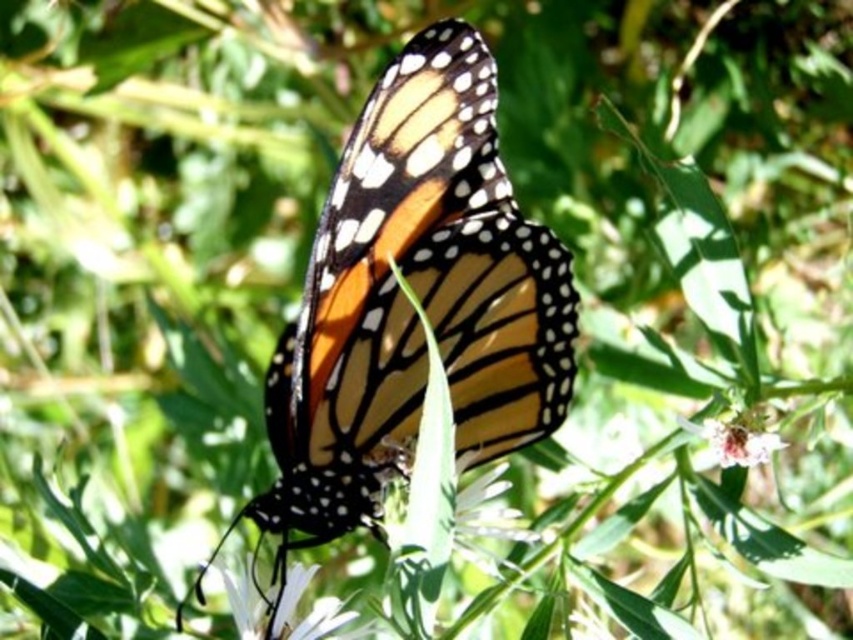
Does orange and black spotted butterfly at center come in front of white textured flower at center?

No, orange and black spotted butterfly at center is behind white textured flower at center.

Who is more forward, (379, 324) or (386, 541)?

Point (386, 541) is in front.

Measure the distance between orange and black spotted butterfly at center and camera.

orange and black spotted butterfly at center is 1.24 meters from camera.

Locate an element on the screen. orange and black spotted butterfly at center is located at coordinates (410, 305).

Is white matte flower at lower center wider than white textured flower at center?

In fact, white matte flower at lower center might be narrower than white textured flower at center.

This screenshot has width=853, height=640. In order to click on white matte flower at lower center in this screenshot , I will do `click(285, 608)`.

Is orange and black spotted butterfly at center below white fuzzy flower at center?

No.

Is point (279, 484) positioned behind point (718, 451)?

No, (279, 484) is closer to viewer.

Identify the location of orange and black spotted butterfly at center. The width and height of the screenshot is (853, 640). (410, 305).

The image size is (853, 640). I want to click on orange and black spotted butterfly at center, so click(x=410, y=305).